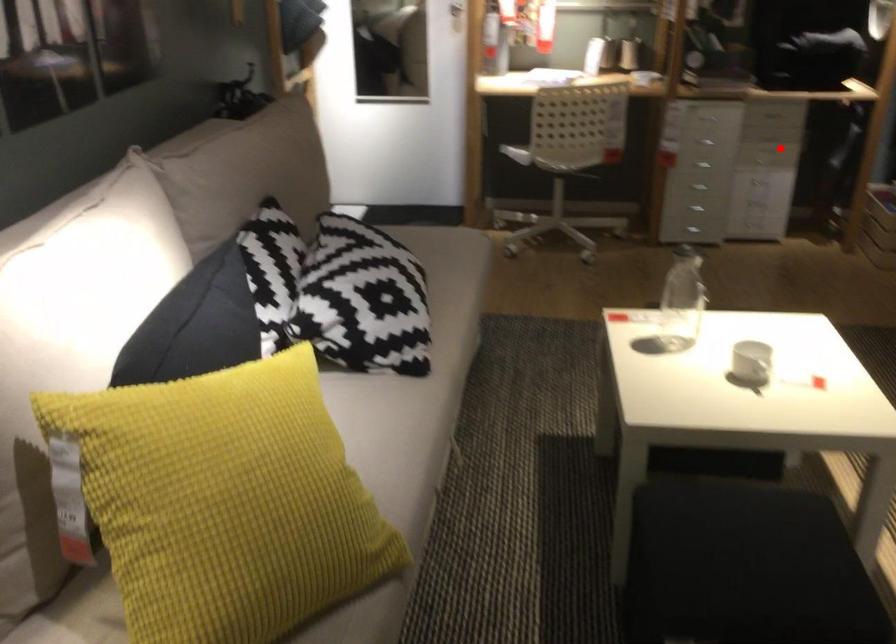
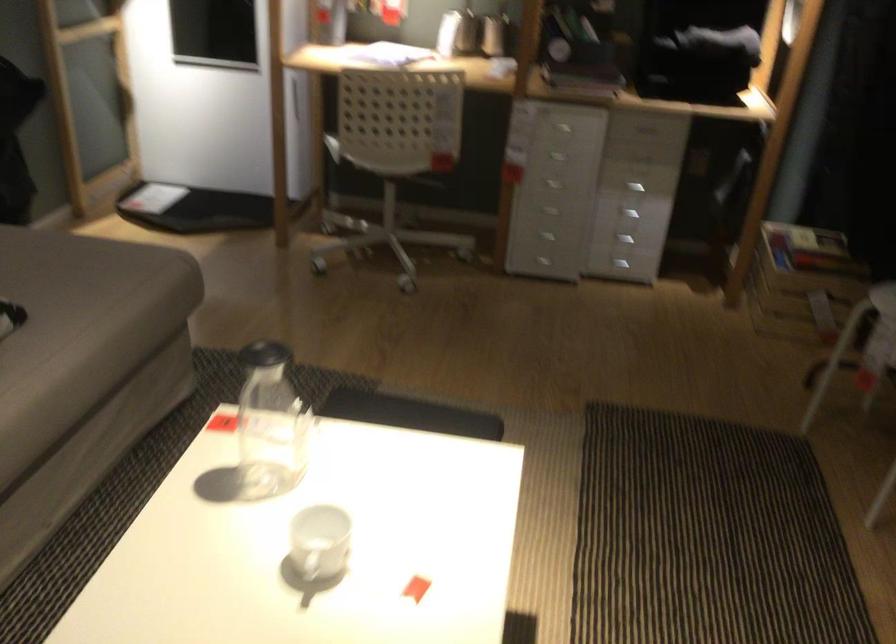
Question: I am providing you with two images of the same scene from different viewpoints. In image1, a red point is highlighted. Considering the same 3D point in image2, which of the following is correct?

Choices:
 (A) It is closer
 (B) It is farther

Answer: (A)